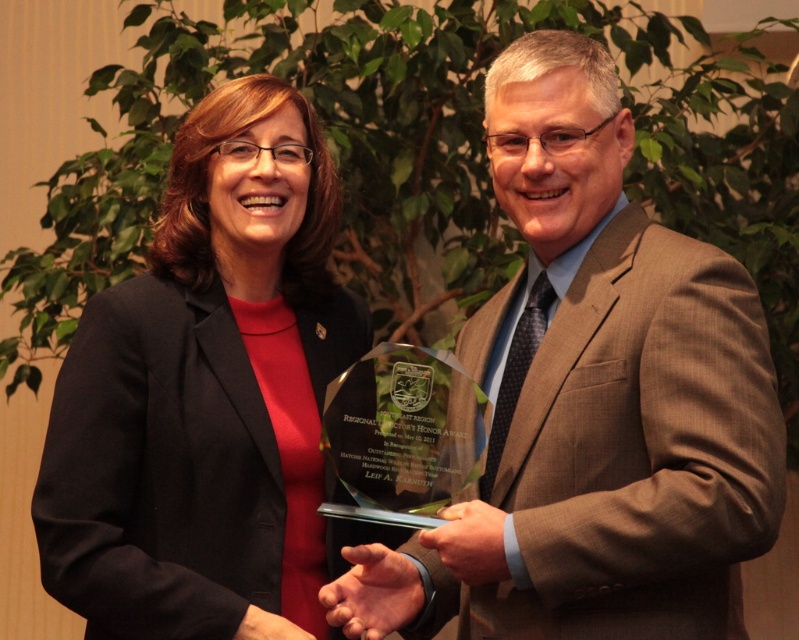
Question: Which point appears farthest from the camera in this image?

Choices:
 (A) coord(539,564)
 (B) coord(240,632)

Answer: (B)

Question: Does brown textured suit at center have a greater width compared to matte black blazer at center?

Choices:
 (A) yes
 (B) no

Answer: (A)

Question: Among these objects, which one is nearest to the camera?

Choices:
 (A) matte black blazer at center
 (B) brown textured suit at center

Answer: (B)

Question: Can you confirm if brown textured suit at center is thinner than matte black blazer at center?

Choices:
 (A) yes
 (B) no

Answer: (B)

Question: Is brown textured suit at center wider than matte black blazer at center?

Choices:
 (A) yes
 (B) no

Answer: (A)